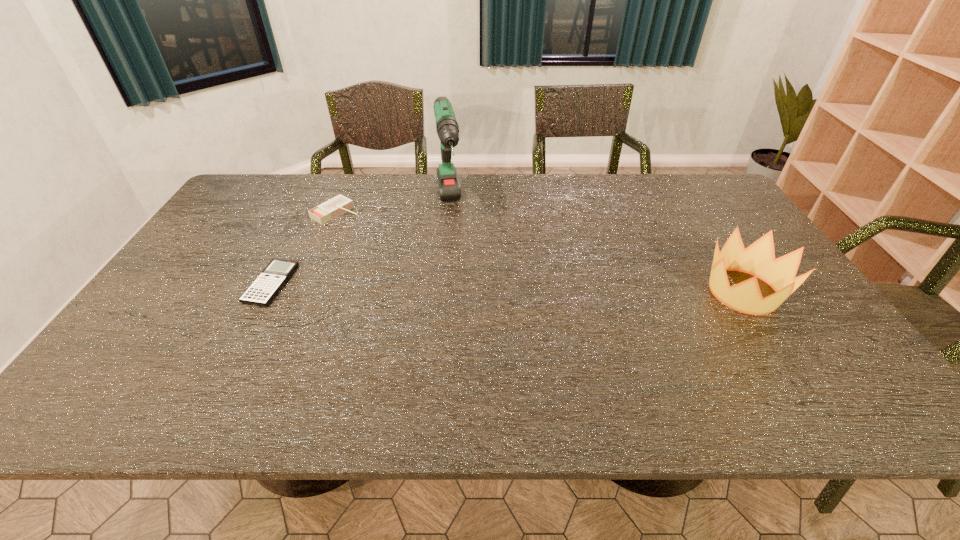
You are a GUI agent. You are given a task and a screenshot of the screen. Output one action in this format:
    pyautogui.click(x=<x>, y=<y>)
    Task: Click on the vacant space that's between the tallest object and the third shortest object
    Image resolution: width=960 pixels, height=540 pixels.
    Given the screenshot: What is the action you would take?
    pyautogui.click(x=595, y=248)

The width and height of the screenshot is (960, 540). Find the location of `unoccupied position between the matchbox and the third shortest object`. unoccupied position between the matchbox and the third shortest object is located at coordinates (540, 252).

Locate an element on the screen. The width and height of the screenshot is (960, 540). free spot between the shortest object and the third object from left to right is located at coordinates (360, 244).

Find the location of `object that ranks as the closest to the calculator`. object that ranks as the closest to the calculator is located at coordinates (340, 204).

Identify which object is the closest to the third tallest object. Please provide its 2D coordinates. Your answer should be formatted as a tuple, i.e. [(x, y)], where the tuple contains the x and y coordinates of a point satisfying the conditions above.

[(266, 286)]

Find the location of `vacant space that satisfies the following two spatial constraints: 1. on the back side of the calculator; 2. on the right side of the matchbox`. vacant space that satisfies the following two spatial constraints: 1. on the back side of the calculator; 2. on the right side of the matchbox is located at coordinates (308, 213).